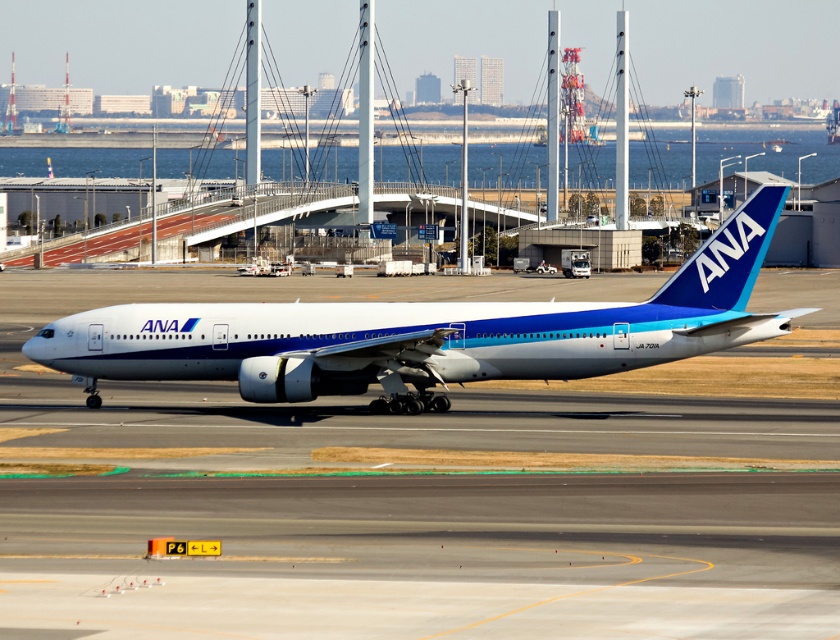
Can you confirm if white smooth tarmac at center is smaller than white glossy airplane at center?

Actually, white smooth tarmac at center might be larger than white glossy airplane at center.

Can you confirm if white smooth tarmac at center is positioned to the left of white glossy airplane at center?

No, white smooth tarmac at center is not to the left of white glossy airplane at center.

Does point (696, 486) come behind point (618, 324)?

No, it is not.

Find the location of a particular element. This screenshot has width=840, height=640. white smooth tarmac at center is located at coordinates (405, 493).